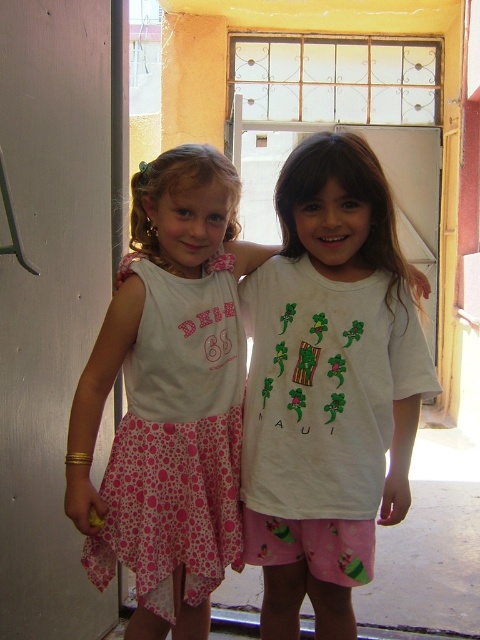
You are trying to decide which clothing item to wear for a casual day out. Given the white cotton shirt at center and the pink dotted fabric dress at left, which one offers more coverage for your arms?

The white cotton shirt at center has a larger width than the pink dotted fabric dress at left, but this does not directly indicate arm coverage. To determine arm coverage, we need to look at sleeve length. Since the description does not provide information about sleeve lengths, we cannot definitively answer which offers more arm coverage based on the given details.

You are a delivery person with a package that is 20 inches long. You need to slide it through the gap between the white matte door at left and the pink dotted fabric dress at left. Can the package fit through the gap?

The distance between the white matte door at left and the pink dotted fabric dress at left is 20.31 inches, so the 20 inch package can fit through the gap since it is slightly narrower than the available space.